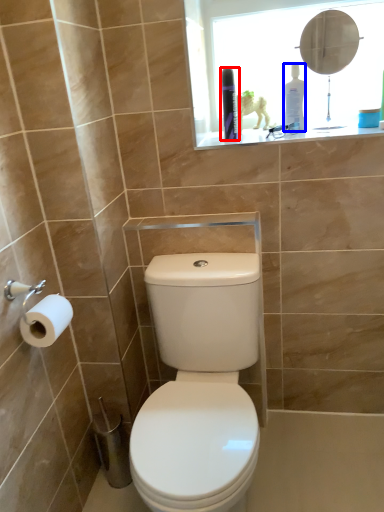
Question: Which of the following is the closest to the observer, toiletry (highlighted by a red box) or toiletry (highlighted by a blue box)?

Choices:
 (A) toiletry
 (B) toiletry

Answer: (A)